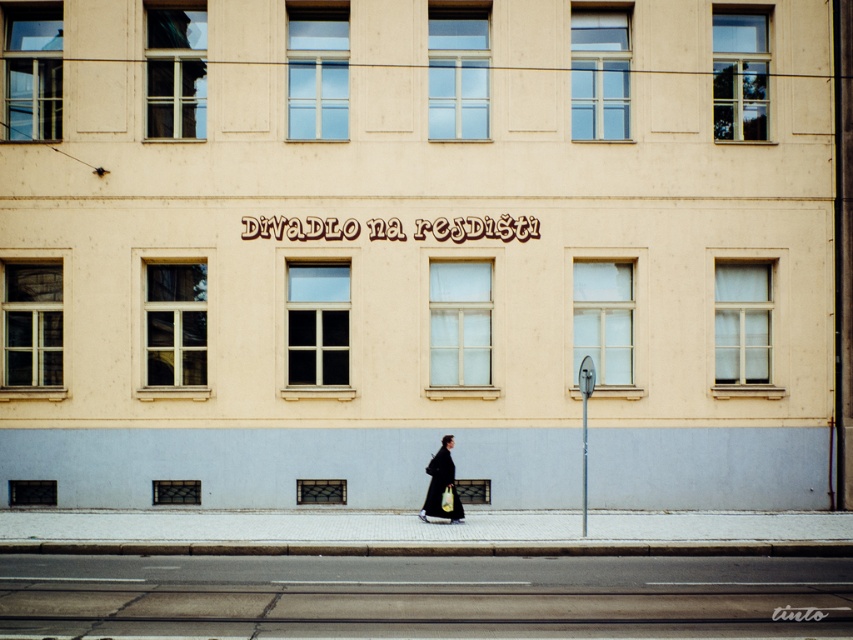
Question: Does gray asphalt at lower center appear over dark matte coat at center?

Choices:
 (A) no
 (B) yes

Answer: (A)

Question: Which point is farther from the camera taking this photo?

Choices:
 (A) (434, 513)
 (B) (28, 573)

Answer: (A)

Question: Does gray asphalt at lower center have a larger size compared to dark matte coat at center?

Choices:
 (A) yes
 (B) no

Answer: (B)

Question: Can you confirm if gray asphalt at lower center is thinner than dark matte coat at center?

Choices:
 (A) yes
 (B) no

Answer: (A)